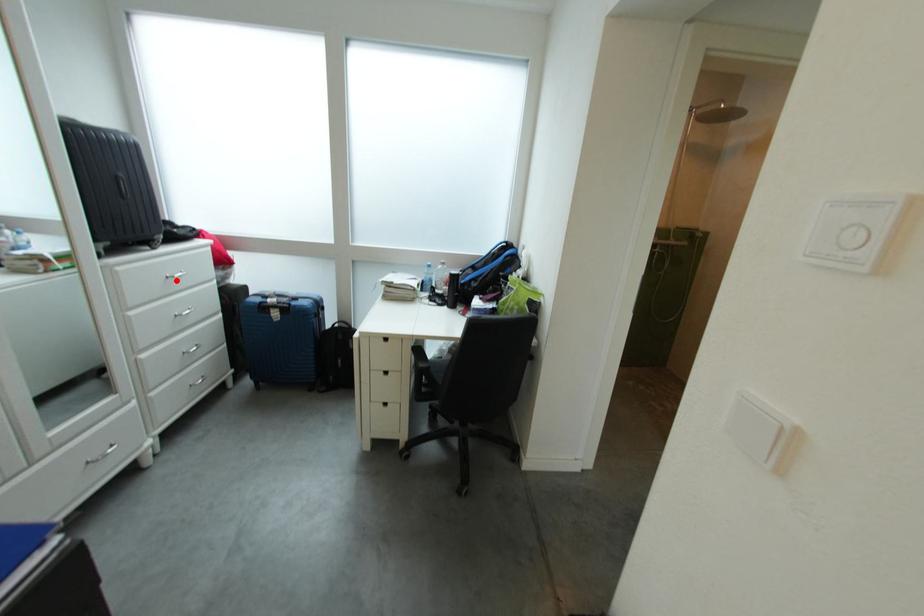
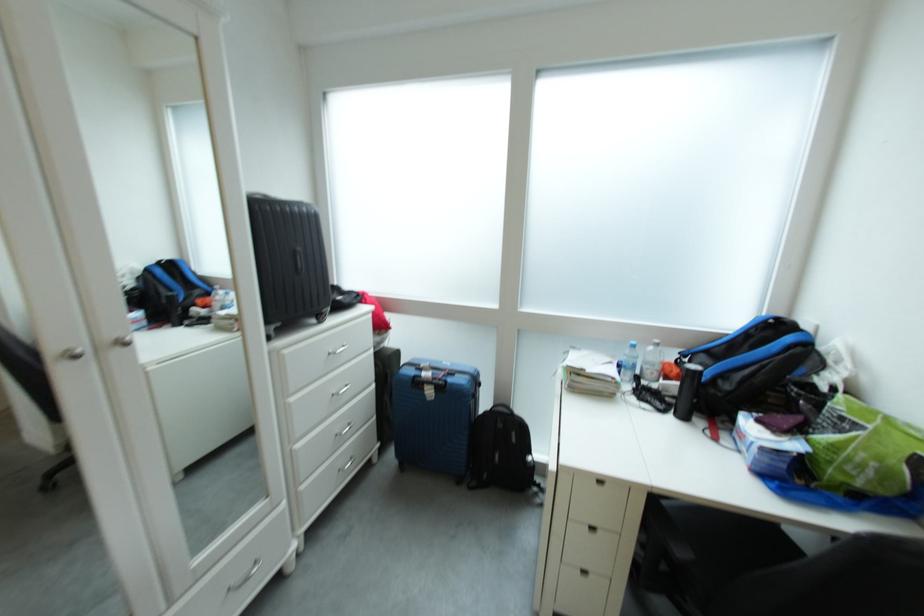
Question: I am providing you with two images of the same scene from different viewpoints. In image1, a red point is highlighted. Considering the same 3D point in image2, which of the following is correct?

Choices:
 (A) It is closer
 (B) It is farther

Answer: (A)